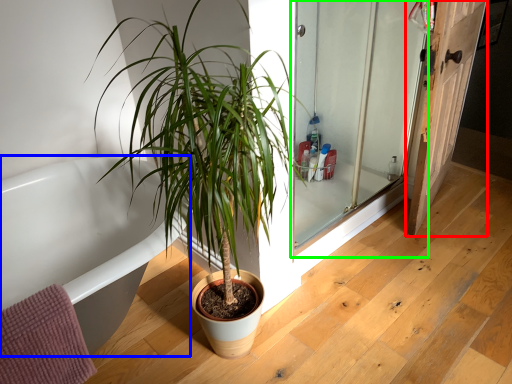
Question: Which is nearer to the door (highlighted by a red box)? bathtub (highlighted by a blue box) or screen door (highlighted by a green box).

Choices:
 (A) bathtub
 (B) screen door

Answer: (B)